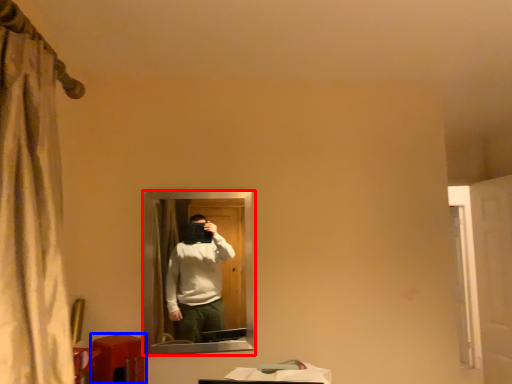
Question: Which object is closer to the camera taking this photo, mirror (highlighted by a red box) or table (highlighted by a blue box)?

Choices:
 (A) mirror
 (B) table

Answer: (B)